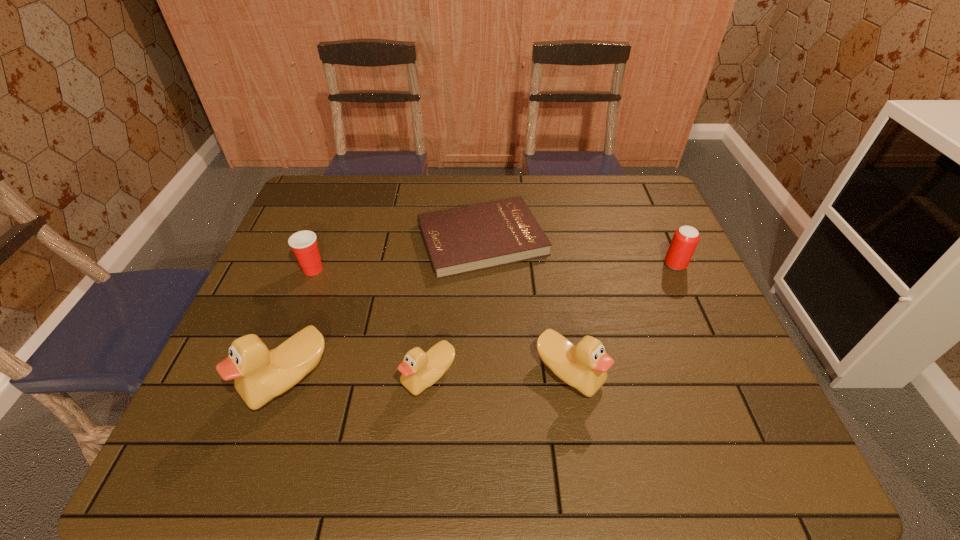
The width and height of the screenshot is (960, 540). Find the location of `vacant position in the image that satisfies the following two spatial constraints: 1. at the beak of the rightmost duck; 2. at the beak of the second duck from right to left`. vacant position in the image that satisfies the following two spatial constraints: 1. at the beak of the rightmost duck; 2. at the beak of the second duck from right to left is located at coordinates (569, 376).

Where is `free space in the image that satisfies the following two spatial constraints: 1. at the beak of the second shortest duck; 2. at the beak of the second duck from left to right`? free space in the image that satisfies the following two spatial constraints: 1. at the beak of the second shortest duck; 2. at the beak of the second duck from left to right is located at coordinates (569, 376).

Image resolution: width=960 pixels, height=540 pixels. I want to click on free location that satisfies the following two spatial constraints: 1. at the beak of the rightmost duck; 2. at the beak of the leftmost duck, so click(570, 379).